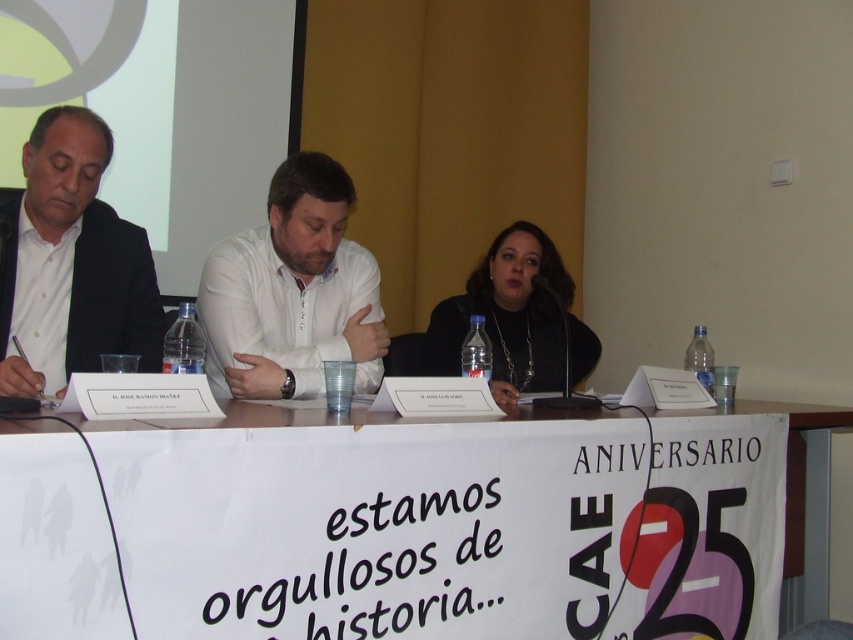
Between white shirt at left and white shirt at center, which one appears on the left side from the viewer's perspective?

white shirt at left

Between white shirt at left and white shirt at center, which one has less height?

white shirt at center is shorter.

What do you see at coordinates (71, 264) in the screenshot? The height and width of the screenshot is (640, 853). I see `white shirt at left` at bounding box center [71, 264].

In order to click on white shirt at left in this screenshot , I will do `click(71, 264)`.

Can you confirm if white shirt at left is positioned to the left of matte black jacket at center?

→ Indeed, white shirt at left is positioned on the left side of matte black jacket at center.

This screenshot has height=640, width=853. Describe the element at coordinates (71, 264) in the screenshot. I see `white shirt at left` at that location.

Does point (97, 330) come farther from viewer compared to point (546, 356)?

That is False.

Where is `white shirt at left`? Image resolution: width=853 pixels, height=640 pixels. white shirt at left is located at coordinates [x=71, y=264].

Can you confirm if white shirt at center is thinner than matte black jacket at center?

Correct, white shirt at center's width is less than matte black jacket at center's.

Who is higher up, white shirt at center or matte black jacket at center?

white shirt at center is higher up.

Is point (341, 189) in front of point (521, 230)?

Yes, point (341, 189) is closer to viewer.

This screenshot has width=853, height=640. What are the coordinates of `white shirt at center` in the screenshot? It's located at (292, 292).